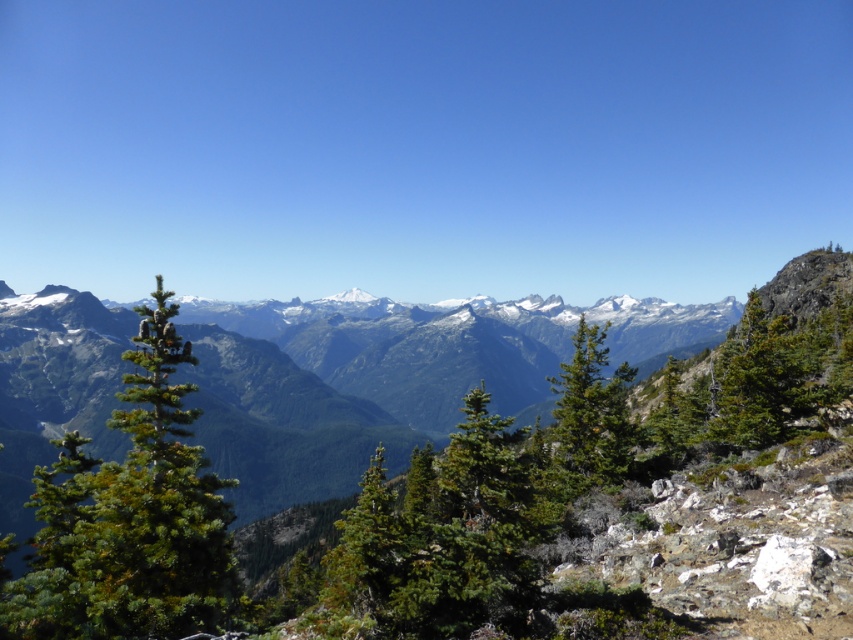
You are standing at the origin point of the coordinate system in the image. You want to locate the green textured pine trees at center. What are their coordinates?

The green textured pine trees at center are located at coordinates point (351,401).

You are an environmental scientist studying the spatial distribution of pine trees in this mountainous area. You observe the green textured pine trees at center and the green textured pine tree at center. Which of these two is positioned further away from your observation point?

The green textured pine tree at center is positioned further away from the observation point because it is described as being behind the green textured pine trees at center.